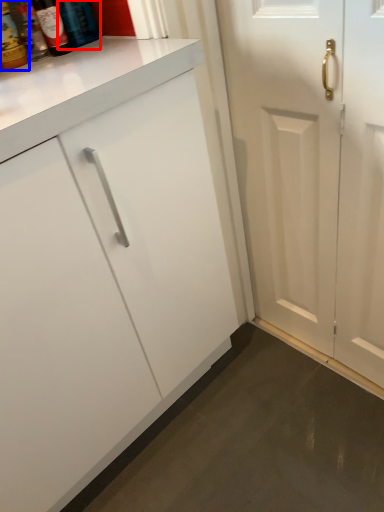
Question: Which object appears farthest to the camera in this image, bottle (highlighted by a red box) or bottle (highlighted by a blue box)?

Choices:
 (A) bottle
 (B) bottle

Answer: (A)